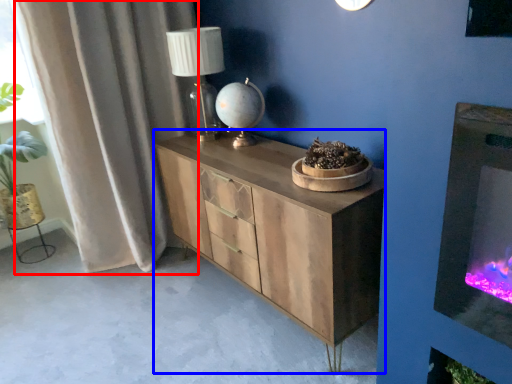
Question: Which of the following is the farthest to the observer, curtain (highlighted by a red box) or chest of drawers (highlighted by a blue box)?

Choices:
 (A) curtain
 (B) chest of drawers

Answer: (A)